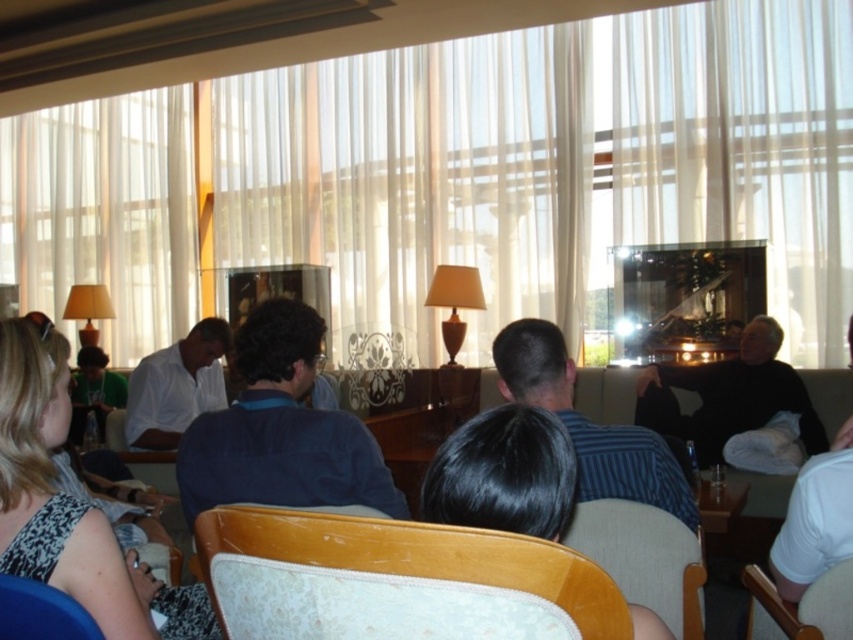
Which is behind, point (508, 476) or point (212, 316)?

Point (212, 316)

Measure the distance from black hair at center to white matte shirt at center.

black hair at center is 3.16 meters from white matte shirt at center.

Locate an element on the screen. The width and height of the screenshot is (853, 640). black hair at center is located at coordinates (503, 474).

Is point (751, 579) less distant than point (65, 604)?

No, (751, 579) is further to viewer.

What do you see at coordinates (799, 605) in the screenshot? The height and width of the screenshot is (640, 853). I see `wooden chair at lower right` at bounding box center [799, 605].

This screenshot has height=640, width=853. I want to click on wooden chair at lower right, so click(x=799, y=605).

Is the position of blue denim shirt at center less distant than that of black matte sweater at right?

Yes, blue denim shirt at center is closer to the viewer.

Is blue denim shirt at center positioned behind black matte sweater at right?

That is False.

At what (x,y) coordinates should I click in order to perform the action: click on blue denim shirt at center. Please return your answer as a coordinate pair (x, y). Looking at the image, I should click on (281, 429).

Locate an element on the screen. The height and width of the screenshot is (640, 853). blue denim shirt at center is located at coordinates (281, 429).